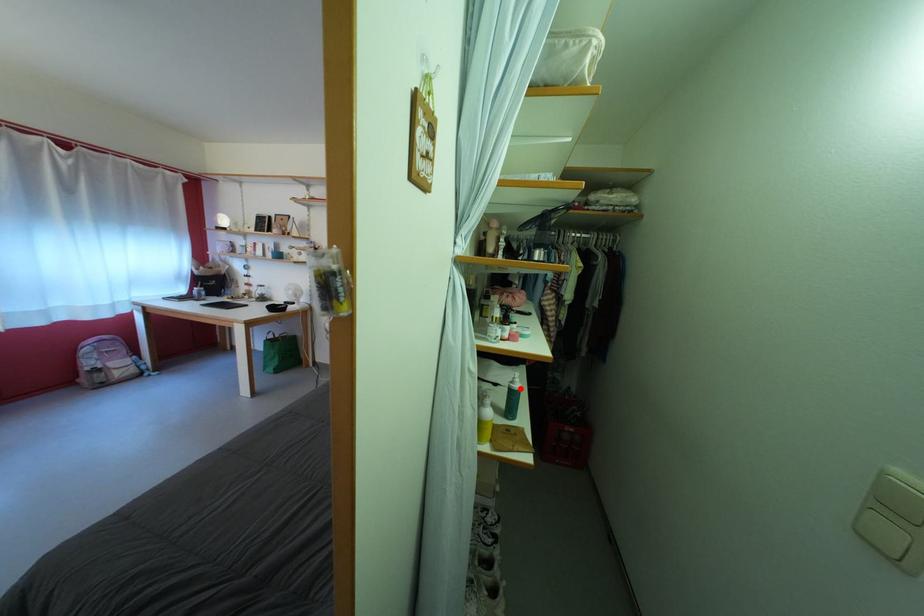
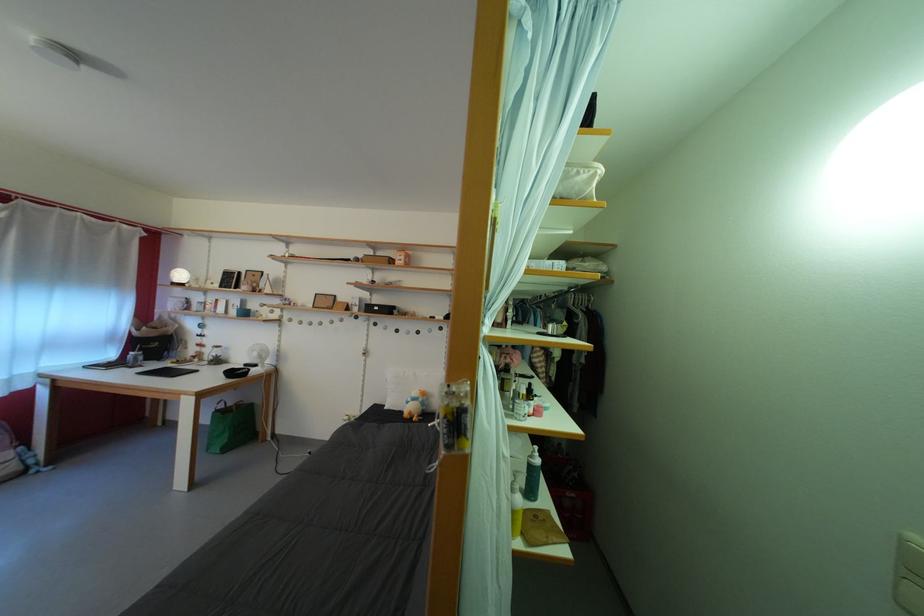
Question: I am providing you with two images of the same scene from different viewpoints. In image1, a red point is highlighted. Considering the same 3D point in image2, which of the following is correct?

Choices:
 (A) It is closer
 (B) It is farther

Answer: (B)